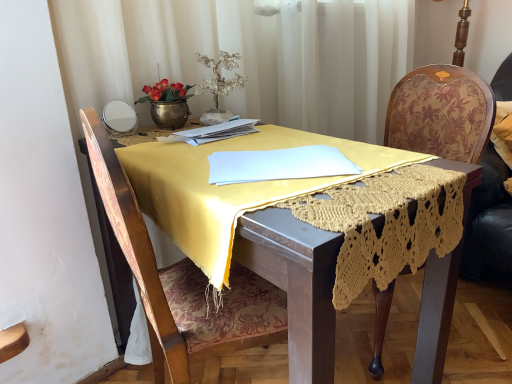
You are a GUI agent. You are given a task and a screenshot of the screen. Output one action in this format:
    pyautogui.click(x=<x>, y=<y>)
    Task: Click on the vacant area that is in front of white paper at center
    The image size is (512, 384).
    Given the screenshot: What is the action you would take?
    pyautogui.click(x=214, y=150)